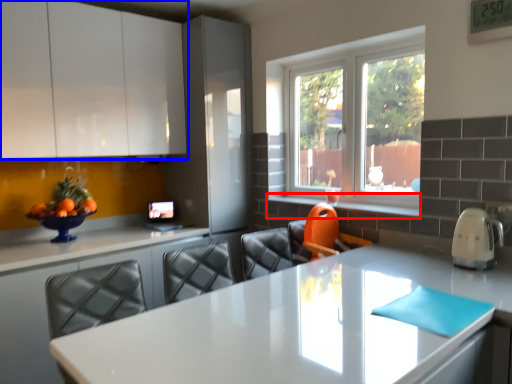
Question: Which point is closer to the camera, window sill (highlighted by a red box) or cabinetry (highlighted by a blue box)?

Choices:
 (A) window sill
 (B) cabinetry

Answer: (B)